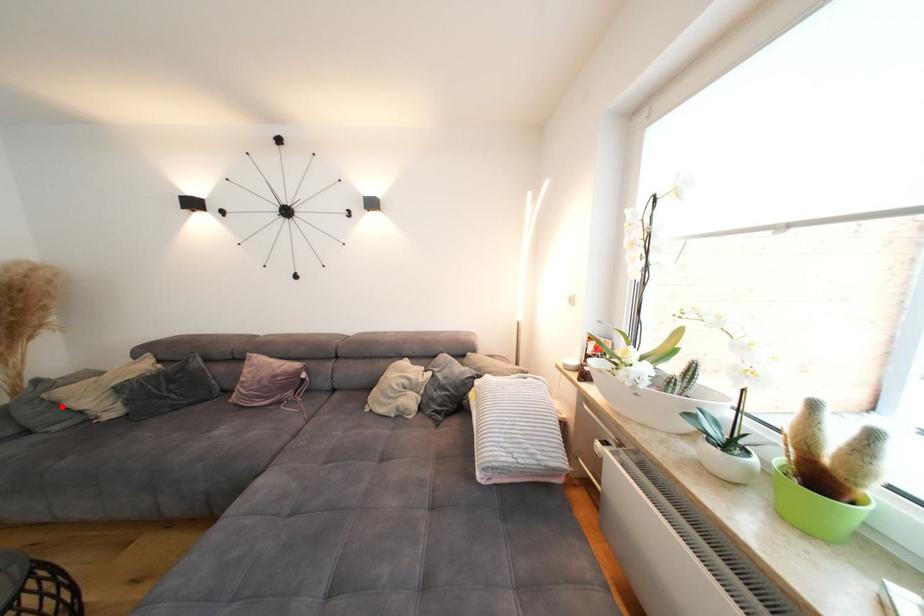
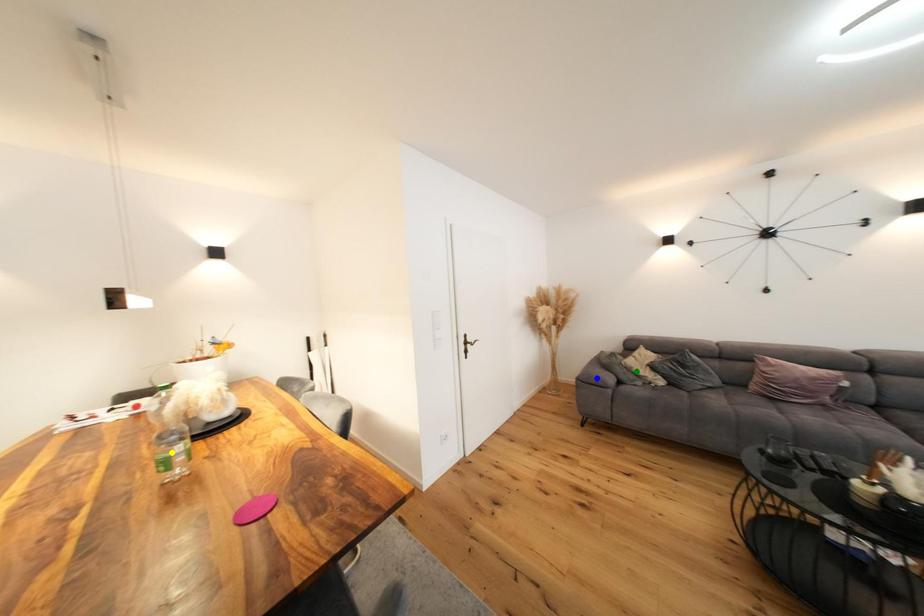
Question: I am providing you with two images of the same scene from different viewpoints. A red point is marked on the first image. You are given multiple points on the second image. Which spot in image 2 lines up with the point in image 1?

Choices:
 (A) green point
 (B) blue point
 (C) yellow point

Answer: (A)